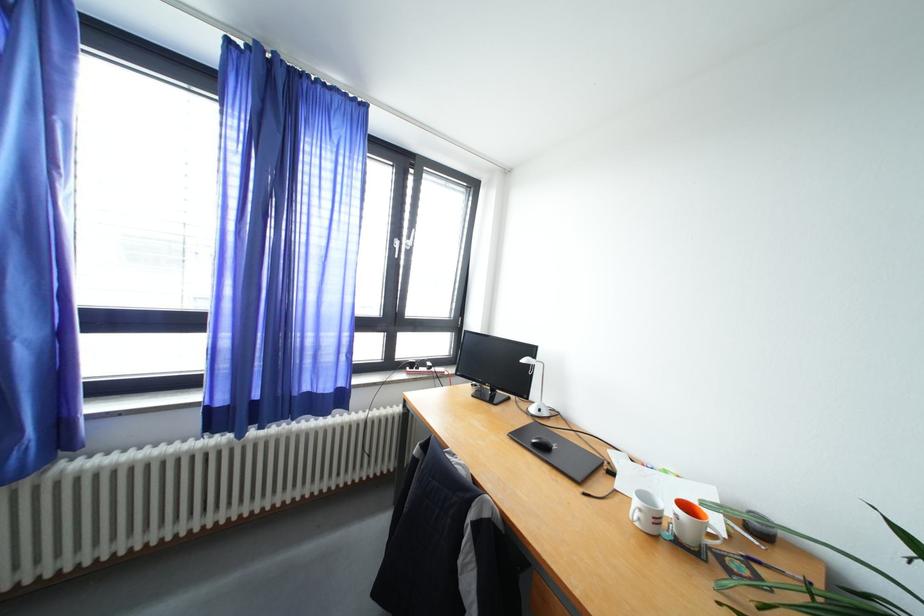
What do you see at coordinates (426, 370) in the screenshot?
I see `a red power switch` at bounding box center [426, 370].